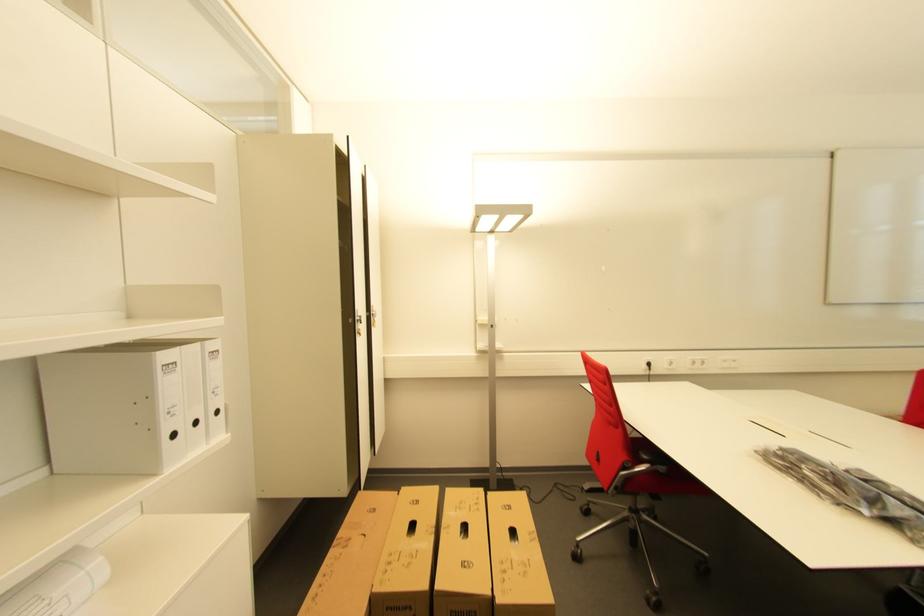
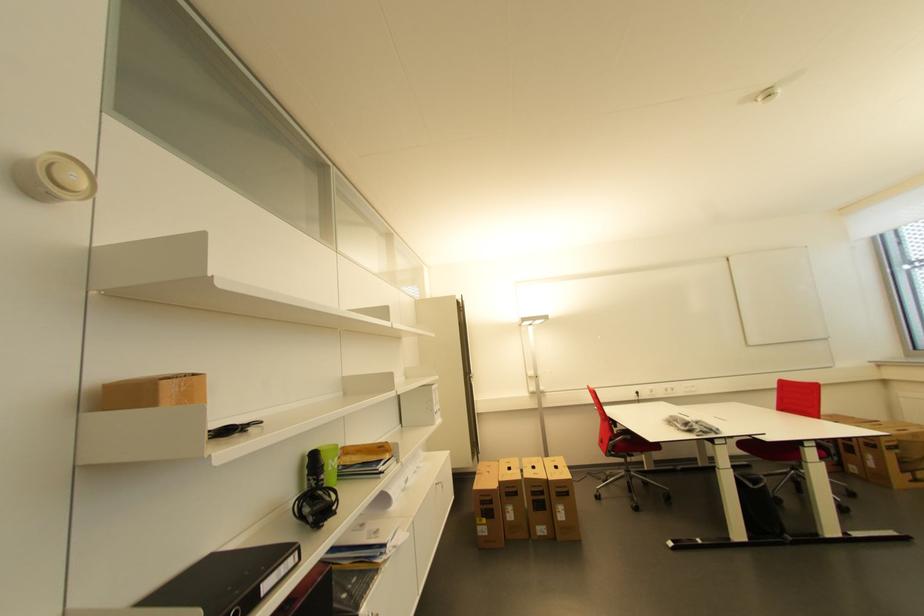
Question: In a continuous first-person perspective shot, in which direction is the camera moving?

Choices:
 (A) Left
 (B) Right
 (C) Forward
 (D) Backward

Answer: (D)